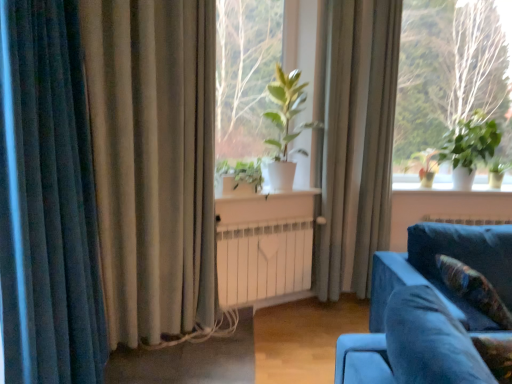
Question: Does green matte plant at right, arranged as the 2th plant when viewed from the left, come behind silky beige curtain at center, the 3th curtain when ordered from front to back?

Choices:
 (A) yes
 (B) no

Answer: (A)

Question: Would you say green matte plant at right, arranged as the 1th plant when viewed from the back, is a long distance from silky beige curtain at center, the third curtain when ordered from left to right?

Choices:
 (A) yes
 (B) no

Answer: (B)

Question: From a real-world perspective, is green matte plant at right, arranged as the 1th plant when viewed from the back, on silky beige curtain at center, which is the 1th curtain from right to left?

Choices:
 (A) yes
 (B) no

Answer: (A)

Question: Is green matte plant at right, which is counted as the second plant, starting from the front, bigger than silky beige curtain at center, which is the 1th curtain from right to left?

Choices:
 (A) no
 (B) yes

Answer: (A)

Question: Considering the relative sizes of green matte plant at right, marked as the 1th plant in a right-to-left arrangement, and silky beige curtain at center, the 3th curtain when ordered from front to back, in the image provided, is green matte plant at right, marked as the 1th plant in a right-to-left arrangement, smaller than silky beige curtain at center, the 3th curtain when ordered from front to back,?

Choices:
 (A) yes
 (B) no

Answer: (A)

Question: Is green matte plant at right, which is counted as the second plant, starting from the front, wider than silky beige curtain at center, the 3th curtain when ordered from front to back?

Choices:
 (A) no
 (B) yes

Answer: (B)

Question: Is green matte plant at center to the left of green leafy plant at center from the viewer's perspective?

Choices:
 (A) yes
 (B) no

Answer: (B)

Question: From a real-world perspective, is green matte plant at center below green leafy plant at center?

Choices:
 (A) yes
 (B) no

Answer: (A)

Question: Considering the relative sizes of green matte plant at center and green leafy plant at center in the image provided, is green matte plant at center bigger than green leafy plant at center?

Choices:
 (A) no
 (B) yes

Answer: (B)

Question: From the image's perspective, is green matte plant at center located above green leafy plant at center?

Choices:
 (A) no
 (B) yes

Answer: (A)

Question: Is green matte plant at center not inside green leafy plant at center?

Choices:
 (A) no
 (B) yes

Answer: (B)

Question: Does green matte plant at center appear on the right side of green leafy plant at center?

Choices:
 (A) yes
 (B) no

Answer: (A)

Question: Is green leafy plant at upper right closer to the viewer compared to green matte plant at center, which ranks as the 1th plant in left-to-right order?

Choices:
 (A) no
 (B) yes

Answer: (A)